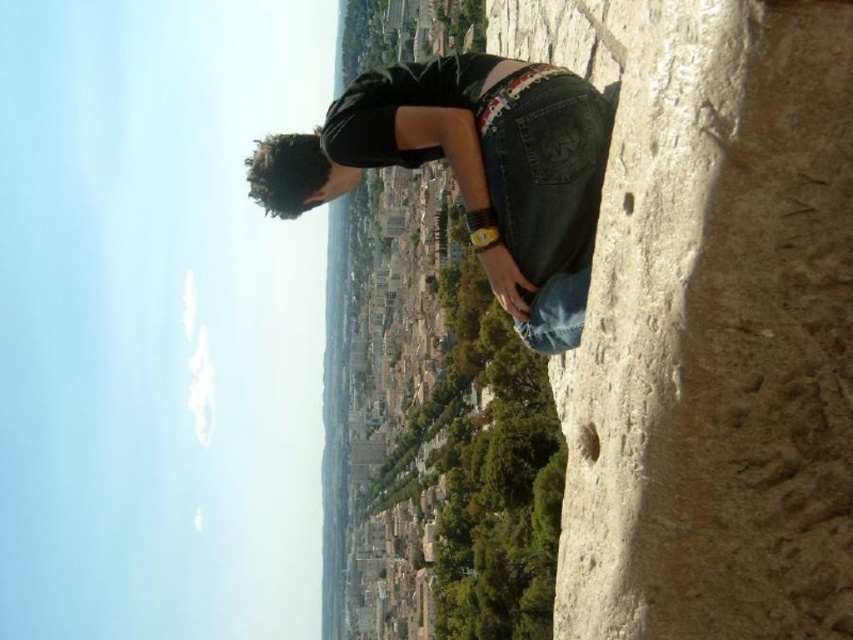
Question: Which point is farther to the camera?

Choices:
 (A) (532, 24)
 (B) (410, 108)

Answer: (A)

Question: Among these objects, which one is nearest to the camera?

Choices:
 (A) rough stone cliff at right
 (B) jeans at center

Answer: (A)

Question: Does rough stone cliff at right lie behind jeans at center?

Choices:
 (A) yes
 (B) no

Answer: (B)

Question: From the image, what is the correct spatial relationship of rough stone cliff at right in relation to jeans at center?

Choices:
 (A) left
 (B) right

Answer: (B)

Question: Where is rough stone cliff at right located in relation to jeans at center in the image?

Choices:
 (A) above
 (B) below

Answer: (A)